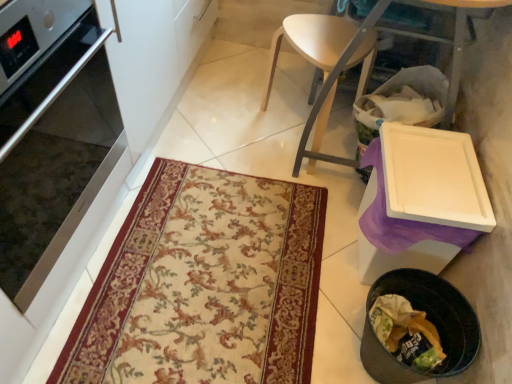
Where is `vacant space that's between light wood chair at center and white plastic cutting board at right`? This screenshot has height=384, width=512. vacant space that's between light wood chair at center and white plastic cutting board at right is located at coordinates (284, 119).